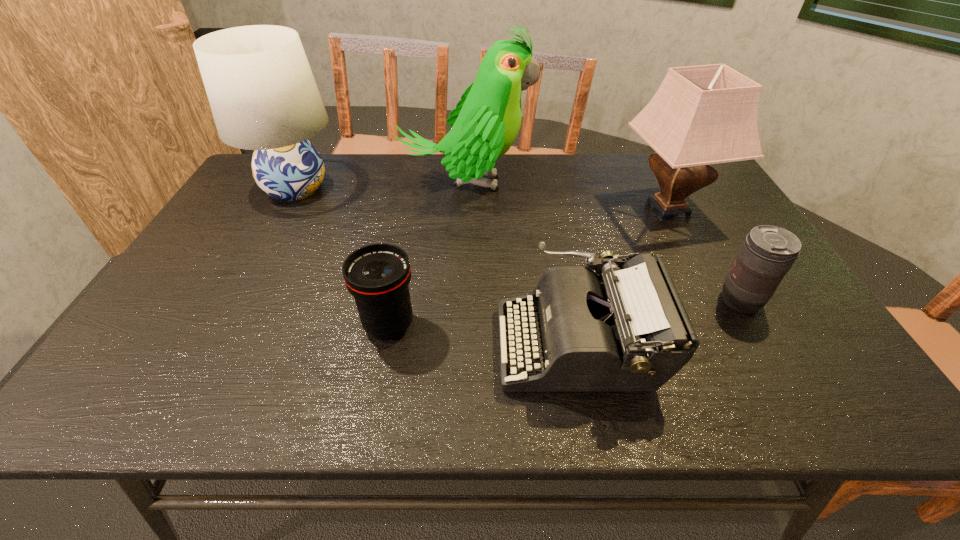
This screenshot has height=540, width=960. I want to click on free space located on the side of the right telephoto lens where the control switches are located, so 635,301.

At what (x,y) coordinates should I click in order to perform the action: click on blank area located 0.350m on the side of the right telephoto lens where the control switches are located. Please return your answer as a coordinate pair (x, y). The height and width of the screenshot is (540, 960). Looking at the image, I should click on (572, 301).

I want to click on vacant space located 0.270m on the left of the left telephoto lens, so click(241, 325).

At what (x,y) coordinates should I click in order to perform the action: click on vacant space situated on the front-facing side of the typewriter. Please return your answer as a coordinate pair (x, y). Looking at the image, I should click on 407,345.

You are a GUI agent. You are given a task and a screenshot of the screen. Output one action in this format:
    pyautogui.click(x=<x>, y=<y>)
    Task: Click on the free space located 0.110m on the front-facing side of the typewriter
    The height and width of the screenshot is (540, 960).
    Given the screenshot: What is the action you would take?
    pyautogui.click(x=448, y=345)

This screenshot has height=540, width=960. In order to click on free spot located on the front-facing side of the typewriter in this screenshot , I will do `click(375, 345)`.

At what (x,y) coordinates should I click in order to perform the action: click on parakeet that is at the far edge. Please return your answer as a coordinate pair (x, y). This screenshot has height=540, width=960. Looking at the image, I should click on (485, 123).

The height and width of the screenshot is (540, 960). I want to click on object that is at the near edge, so click(626, 330).

This screenshot has height=540, width=960. Find the location of `object at the left edge`. object at the left edge is located at coordinates (263, 96).

In order to click on lampshade located in the right edge section of the desktop in this screenshot , I will do click(700, 115).